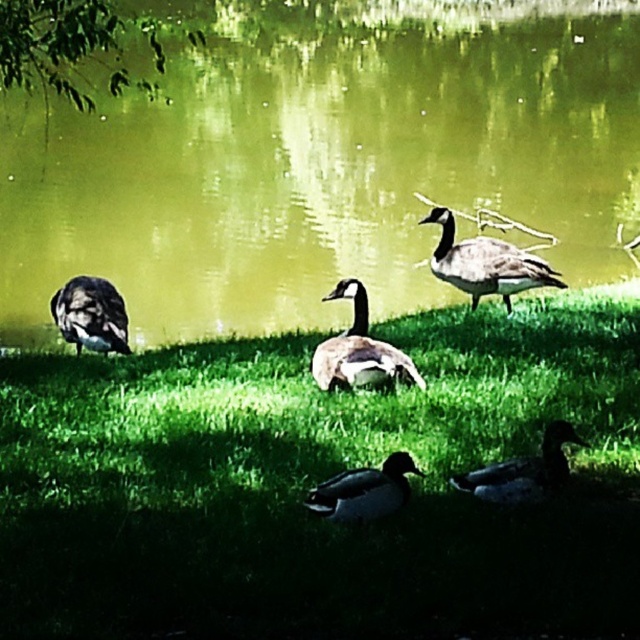
Question: Among these objects, which one is nearest to the camera?

Choices:
 (A) greenish-gray feathers at lower right
 (B) green grassy at center
 (C) green liquid water at center
 (D) brown feathered goose at center

Answer: (A)

Question: Does green liquid water at center have a larger size compared to brown feathered goose at center?

Choices:
 (A) no
 (B) yes

Answer: (B)

Question: Which object appears closest to the camera in this image?

Choices:
 (A) green grassy at center
 (B) gray feathered goose at upper right
 (C) dark green matte duck at center

Answer: (C)

Question: In this image, where is greenish-gray feathers at lower right located relative to dark green matte duck at center?

Choices:
 (A) right
 (B) left

Answer: (A)

Question: Which of the following is the farthest from the observer?

Choices:
 (A) dark brown feathers at lower left
 (B) dark green matte duck at center
 (C) green liquid water at center

Answer: (C)

Question: Is brown feathered goose at center further to the viewer compared to dark green matte duck at center?

Choices:
 (A) yes
 (B) no

Answer: (A)